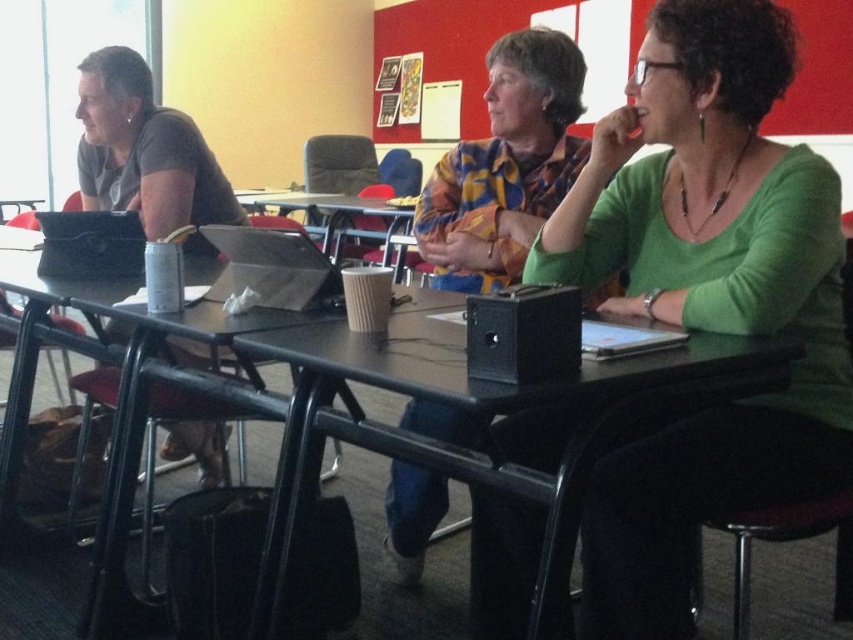
You are standing at the point labeled as point (780, 205) and want to walk to the point labeled as point (163, 198). Which direction should you move to reach your destination?

To reach point (163, 198) from point (780, 205), you should move downward since point (780, 205) is in front of point (163, 198).

You are a student trying to place a heavy textbook on the black plastic table at center without it falling. Considering the position of the floral shirt at center, is there enough space?

The black plastic table at center is positioned under floral shirt at center, so placing the textbook there should be safe as the table is beneath the shirt, providing enough space.